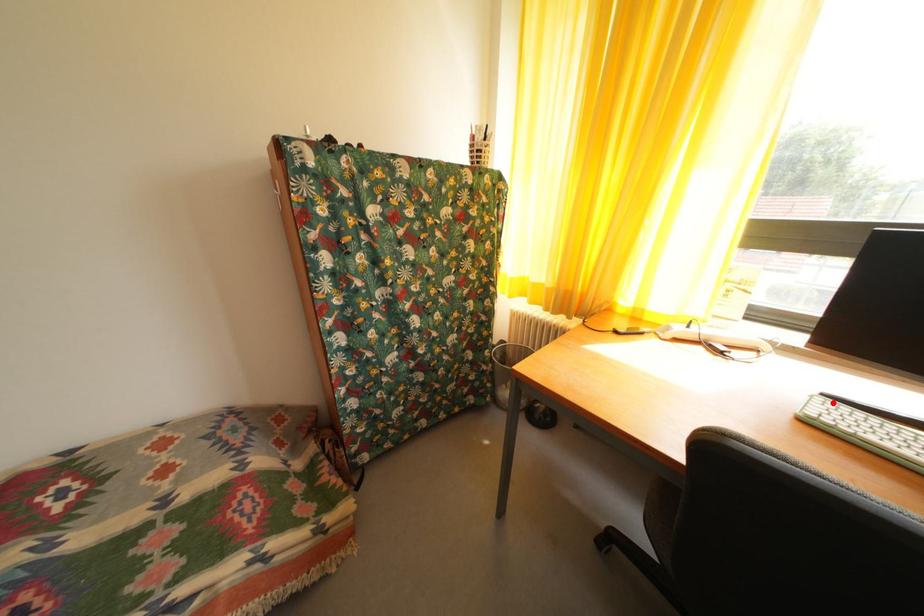
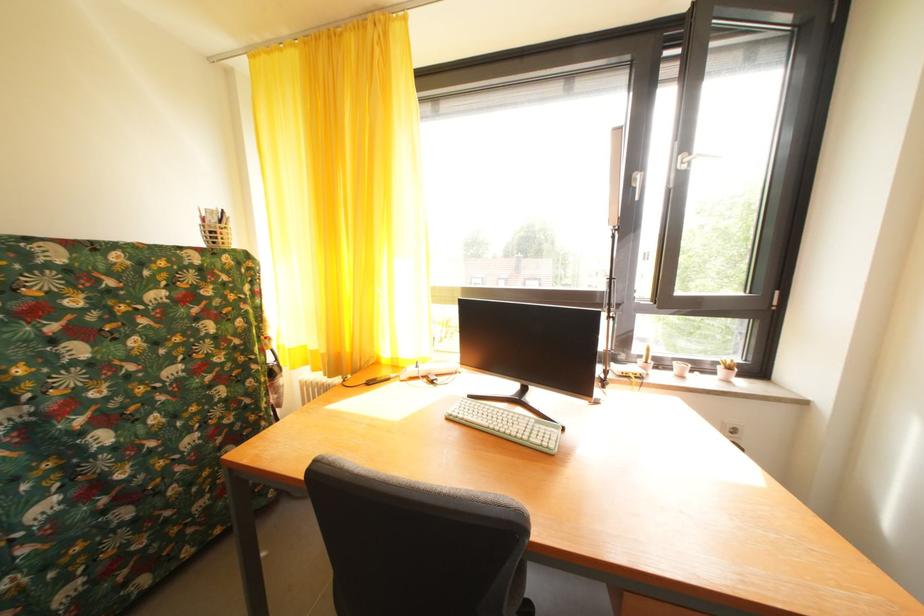
The point at the highlighted location is marked in the first image. Where is the corresponding point in the second image?

(479, 402)